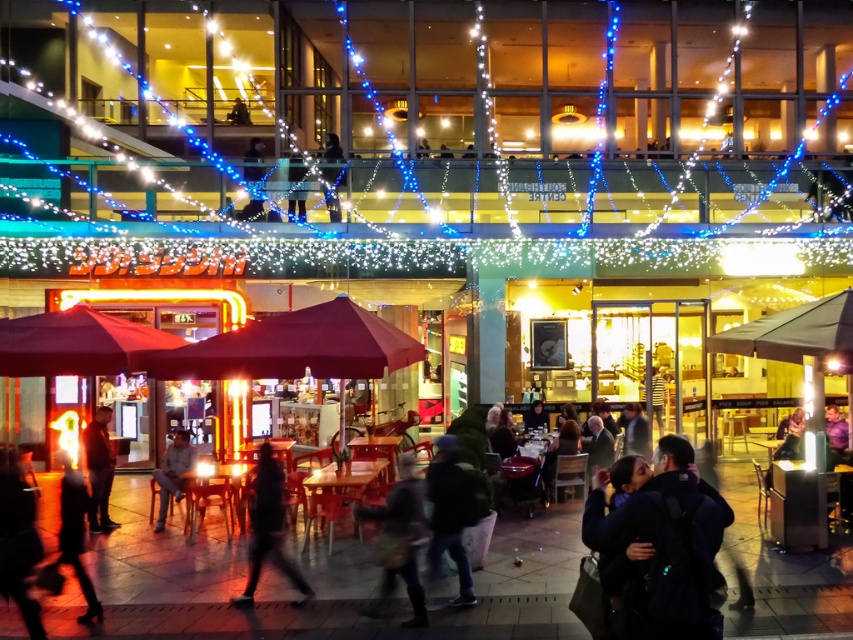
Looking at this image, you are a delivery robot with a 1.5 meter wide package. You need to move from the dark blue jeans at center to the dark fabric jacket at lower left. Can you fit through the space between them?

→ The distance between dark blue jeans at center and dark fabric jacket at lower left is 1.66 meters. Since the package is 1.5 meters wide, the robot can fit through the space as the distance is wider than the package.

You are a delivery person who needs to place a small package between the dark brown leather jacket at lower left and the light brown leather jacket at lower left. Can you fit it there?

The dark brown leather jacket at lower left and light brown leather jacket at lower left are 32.71 inches apart, so yes, the small package can fit between them since the space is sufficient.